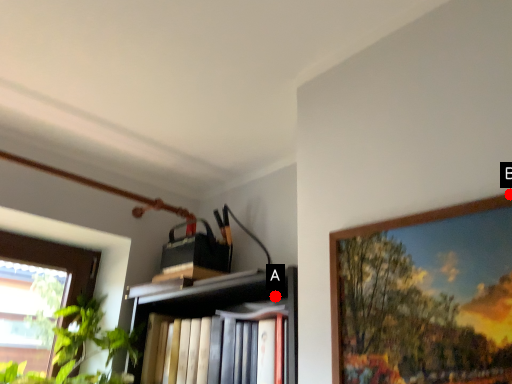
Question: Two points are circled on the image, labeled by A and B beside each circle. Among these points, which one is farthest from the camera?

Choices:
 (A) A is further
 (B) B is further

Answer: (A)